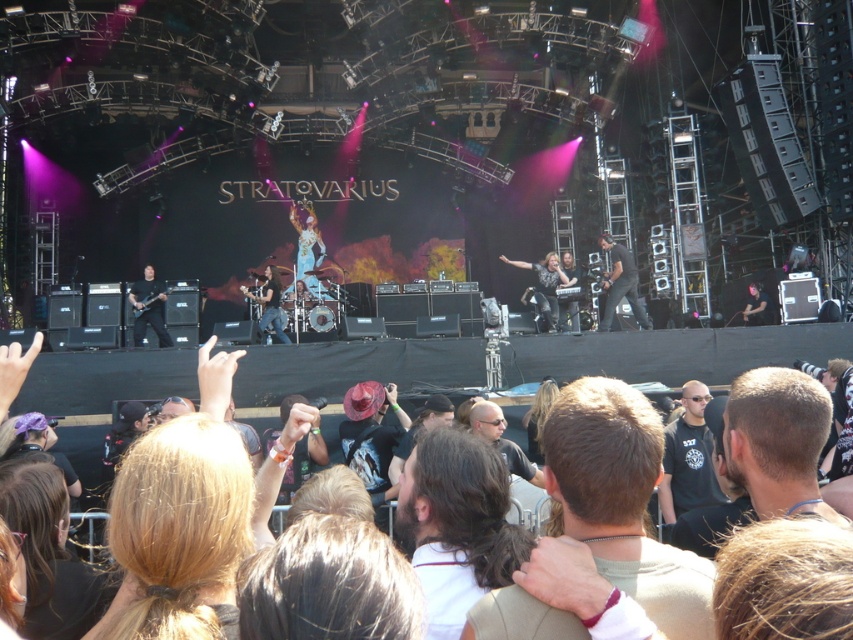
Question: Can you confirm if blonde hair at lower left is smaller than shiny black jacket at center?

Choices:
 (A) no
 (B) yes

Answer: (A)

Question: Is black leather guitar at center closer to the viewer compared to matte black guitar at left?

Choices:
 (A) yes
 (B) no

Answer: (A)

Question: Which point is closer to the camera?

Choices:
 (A) (688, 412)
 (B) (439, 499)
 (C) (553, 316)
 (D) (144, 273)

Answer: (B)

Question: Considering the real-world distances, which object is farthest from the matte black guitar at left?

Choices:
 (A) dark brown hair at center
 (B) shiny black jacket at center
 (C) blonde hair at lower left
 (D) dark brown hair at lower center

Answer: (A)

Question: From the image, what is the correct spatial relationship of dark brown hair at center in relation to shiny black jacket at center?

Choices:
 (A) below
 (B) above

Answer: (A)

Question: Which of the following is the farthest from the observer?

Choices:
 (A) blonde hair at lower left
 (B) black leather guitar at center
 (C) black t-shirt at center
 (D) shiny black jacket at center

Answer: (D)